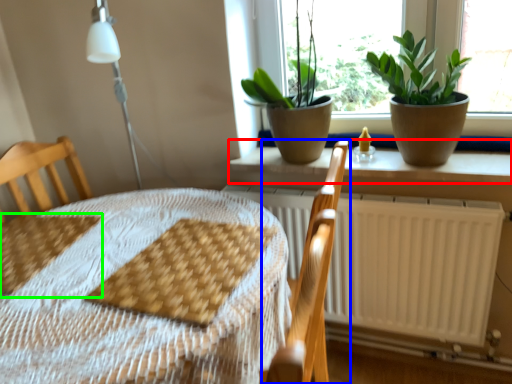
Question: Estimate the real-world distances between objects in this image. Which object is farther from window sill (highlighted by a red box), armchair (highlighted by a blue box) or sheet (highlighted by a green box)?

Choices:
 (A) armchair
 (B) sheet

Answer: (B)